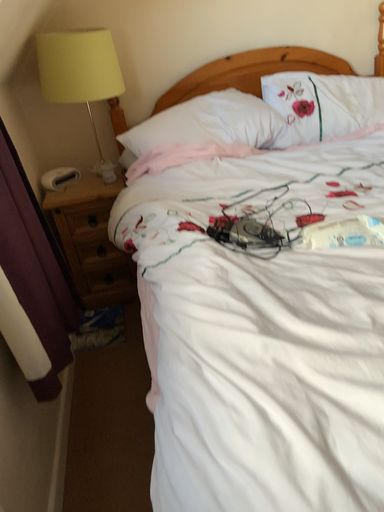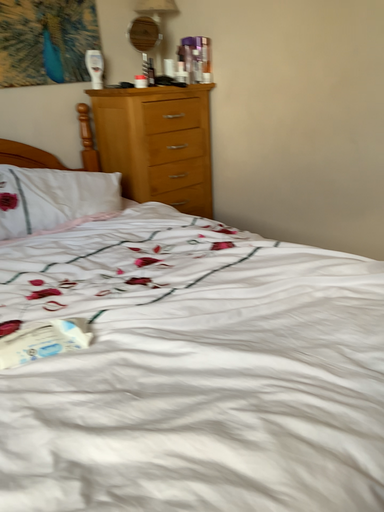
Question: Which way did the camera rotate in the video?

Choices:
 (A) rotated right
 (B) rotated left

Answer: (A)